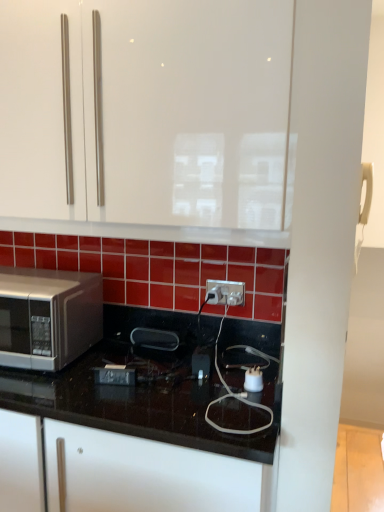
Question: Is satin silver microwave at left in front of or behind white glossy cabinet at upper center in the image?

Choices:
 (A) front
 (B) behind

Answer: (B)

Question: From the image's perspective, is satin silver microwave at left above or below white glossy cabinet at upper center?

Choices:
 (A) below
 (B) above

Answer: (A)

Question: Which is farther from the white plastic electric outlet at center?

Choices:
 (A) black glossy countertop at lower left
 (B) satin silver microwave at left
 (C) white glossy cabinet at upper center

Answer: (C)

Question: Based on their relative distances, which object is nearer to the white glossy cabinet at upper center?

Choices:
 (A) white plastic electric outlet at center
 (B) satin silver microwave at left
 (C) black glossy countertop at lower left

Answer: (B)